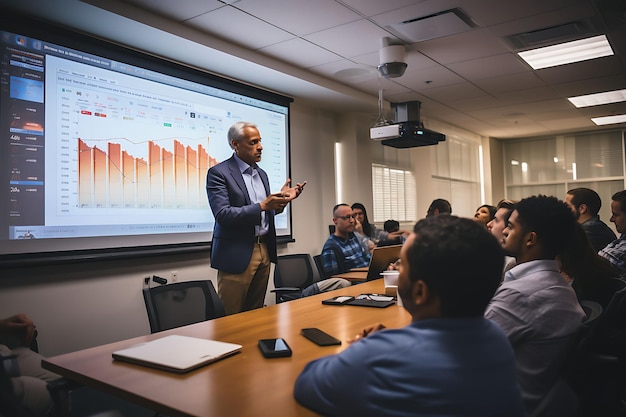
The height and width of the screenshot is (417, 626). In order to click on flourescent lighting in this screenshot , I will do `click(602, 53)`, `click(562, 59)`, `click(623, 98)`, `click(578, 108)`, `click(613, 120)`, `click(598, 125)`.